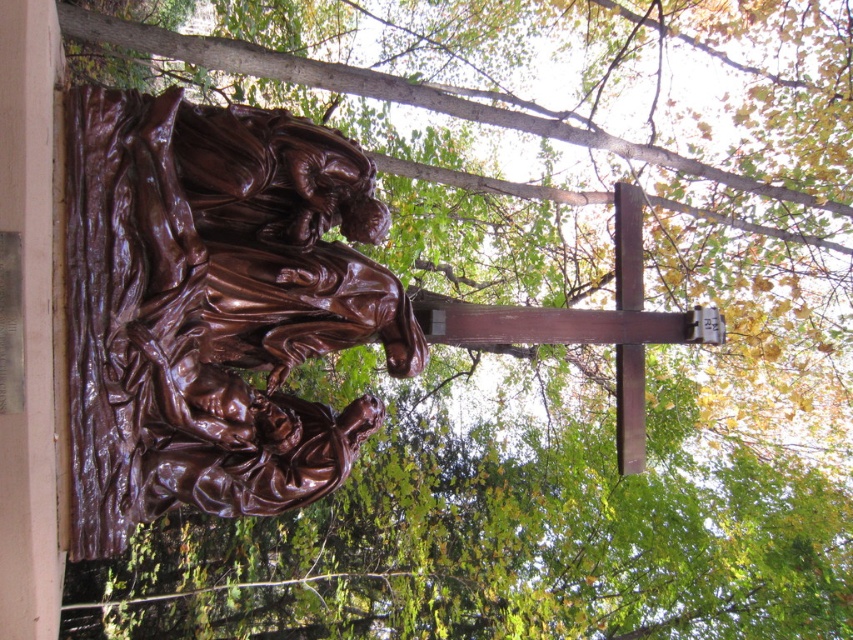
Is bronze sculpture at center to the left of wooden cross at upper center from the viewer's perspective?

Yes, bronze sculpture at center is to the left of wooden cross at upper center.

Which of these two, bronze sculpture at center or wooden cross at upper center, stands shorter?

Standing shorter between the two is bronze sculpture at center.

Is point (242, 417) positioned behind point (553, 307)?

No, it is not.

This screenshot has height=640, width=853. Find the location of `bronze sculpture at center`. bronze sculpture at center is located at coordinates (213, 307).